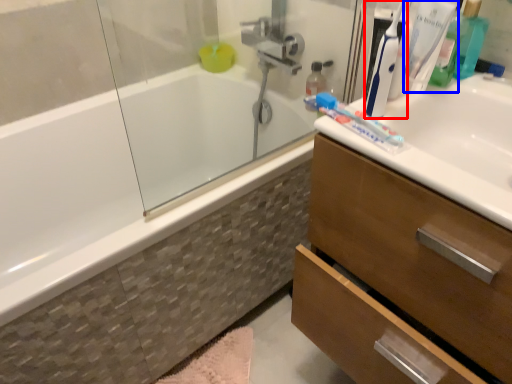
Question: Among these objects, which one is nearest to the camera, toothbrush (highlighted by a red box) or toothbrush (highlighted by a blue box)?

Choices:
 (A) toothbrush
 (B) toothbrush

Answer: (A)